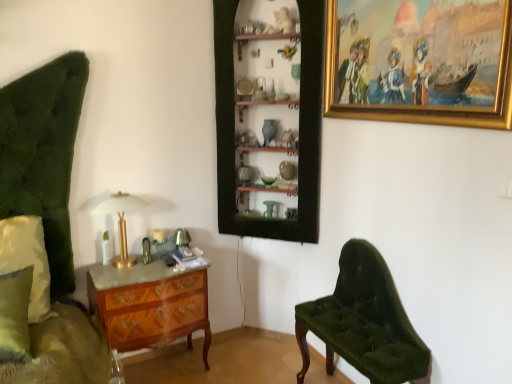
Find the location of `vacant space underneath wooden shelves at center (from a real-world perspective)`. vacant space underneath wooden shelves at center (from a real-world perspective) is located at coordinates (264, 340).